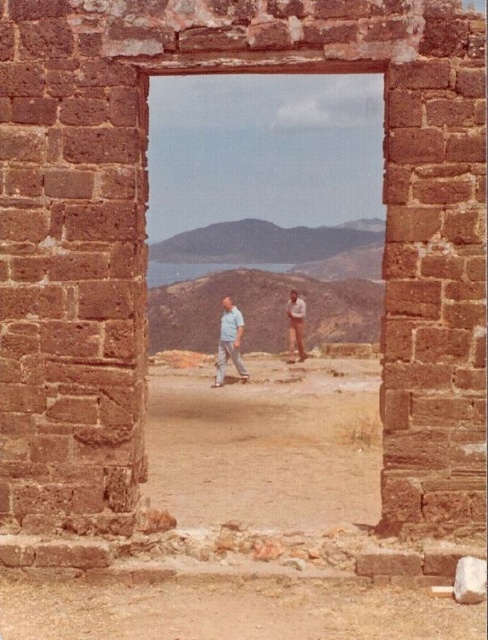
From the picture: You are standing in front of the old brick structure and want to look through the transparent glass window at center to see the light brown leather pants at center. Which direction should you move to align the window with the pants?

The transparent glass window at center is already to the left of the light brown leather pants at center, so you don not need to move. You can look through the transparent glass window at center as it is already aligned to the left of the light brown leather pants at center.

You are standing in front of the old brick structure and want to walk through the doorway. There are two areas of brown sandy dirt at center and brown sandy dirt at lower center. Which area is higher in elevation?

The brown sandy dirt at center is much taller than brown sandy dirt at lower center, so the area at the center is higher in elevation.

You are standing in front of the brick structure and want to see the landscape beyond through the transparent glass window at center. Can you see the light brown leather pants at center through the window?

The transparent glass window at center is wider than the light brown leather pants at center, so yes, you can see the light brown leather pants at center through the window since the window is wider.